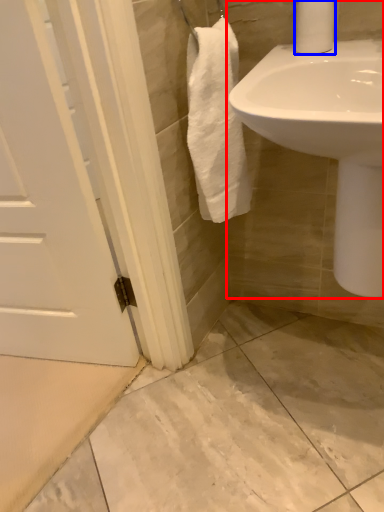
Question: Which object is closer to the camera taking this photo, sink (highlighted by a red box) or toilet paper (highlighted by a blue box)?

Choices:
 (A) sink
 (B) toilet paper

Answer: (A)